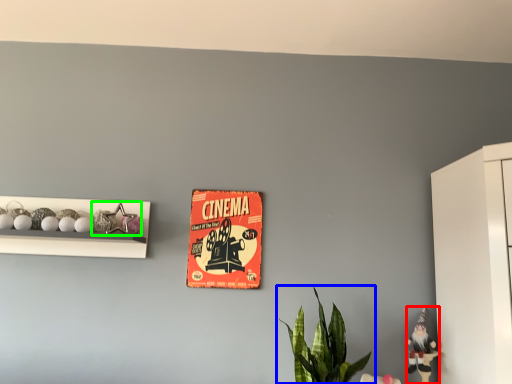
Question: Based on their relative distances, which object is nearer to toy (highlighted by a red box)? Choose from houseplant (highlighted by a blue box) and toy (highlighted by a green box).

Choices:
 (A) houseplant
 (B) toy

Answer: (A)